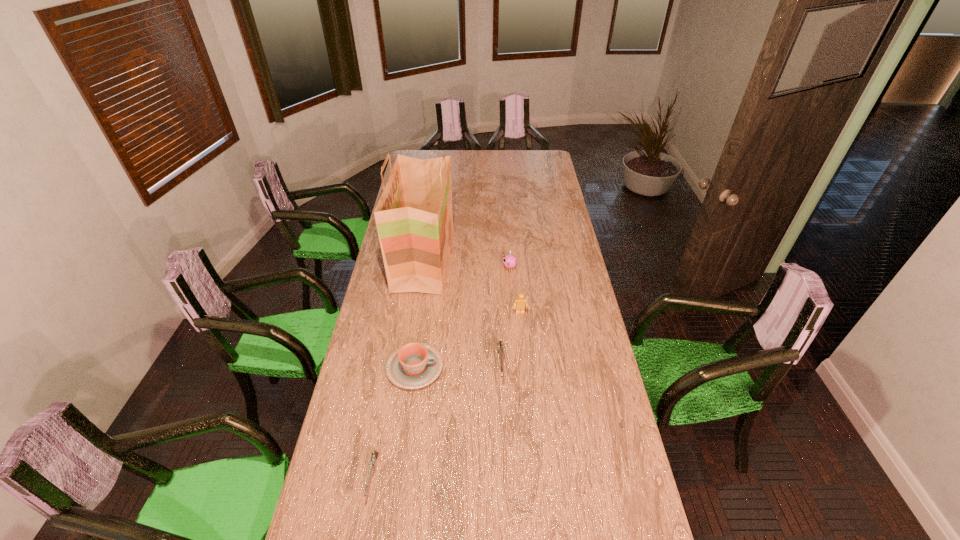
This screenshot has width=960, height=540. In order to click on vacant space at the far edge of the desktop in this screenshot , I will do `click(477, 151)`.

In the image, there is a desktop. At what (x,y) coordinates should I click in order to perform the action: click on free space at the left edge. Please return your answer as a coordinate pair (x, y). This screenshot has width=960, height=540. Looking at the image, I should click on (359, 448).

Locate an element on the screen. The image size is (960, 540). vacant space at the right edge is located at coordinates (606, 446).

The height and width of the screenshot is (540, 960). I want to click on free space between the chinaware and the tallest object, so click(x=420, y=314).

You are a GUI agent. You are given a task and a screenshot of the screen. Output one action in this format:
    pyautogui.click(x=<x>, y=<y>)
    Task: Click on the empty space that is in between the chinaware and the fourth nearest object
    
    Given the screenshot: What is the action you would take?
    pyautogui.click(x=468, y=340)

Locate an element on the screen. This screenshot has height=540, width=960. vacant area that lies between the tallest object and the farther pistol is located at coordinates (463, 313).

At what (x,y) coordinates should I click in order to perform the action: click on free space that is in between the chinaware and the nearest object. Please return your answer as a coordinate pair (x, y). This screenshot has width=960, height=540. Looking at the image, I should click on (394, 422).

You are a GUI agent. You are given a task and a screenshot of the screen. Output one action in this format:
    pyautogui.click(x=<x>, y=<y>)
    Task: Click on the free space between the third object from right to left and the chinaware
    This screenshot has width=960, height=540.
    Given the screenshot: What is the action you would take?
    pyautogui.click(x=458, y=367)

This screenshot has width=960, height=540. Find the location of `vacant area that lies between the cupcake and the grocery bag`. vacant area that lies between the cupcake and the grocery bag is located at coordinates (467, 265).

The image size is (960, 540). Find the location of `vacant area that lies between the Lego and the grocery bag`. vacant area that lies between the Lego and the grocery bag is located at coordinates (472, 287).